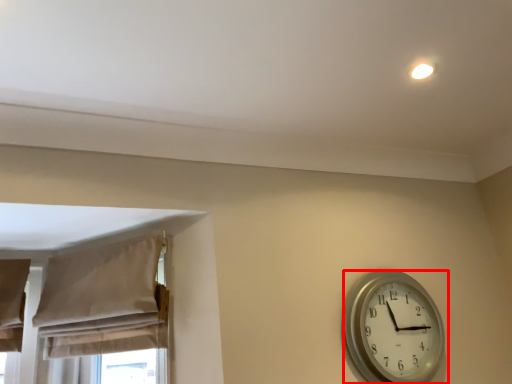
Question: From the image's perspective, where is wall clock (annotated by the red box) located in relation to curtain in the image?

Choices:
 (A) below
 (B) above

Answer: (A)